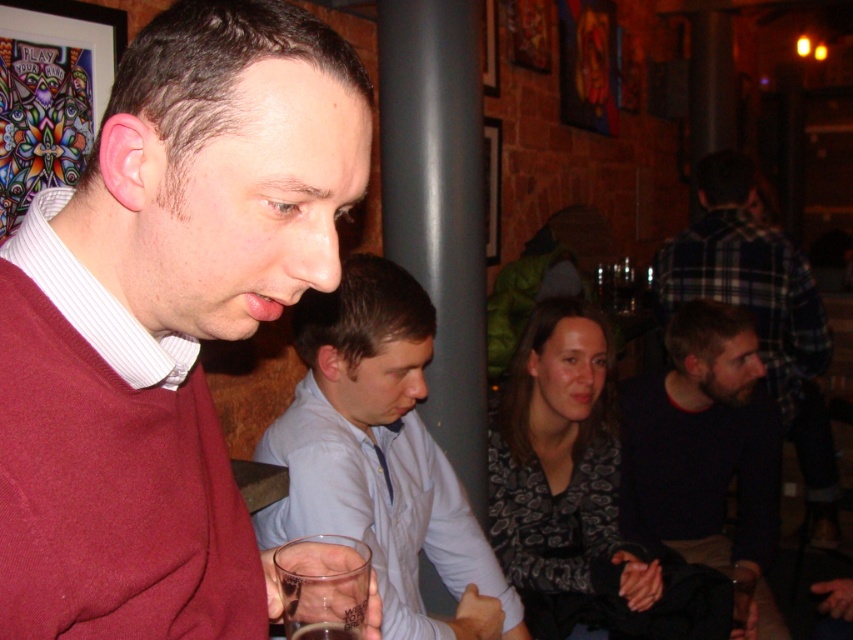
From the picture: You are a fashion designer observing the scene at the bar. You need to determine the layering order of the maroon sweater at center and the white shirt at center. Which one is visible on top?

The maroon sweater at center is positioned over white shirt at center, so the maroon sweater at center is visible on top.

You are standing at the entrance of the bar and want to find the man in the maroon sweater at center. According to the coordinates provided, which direction should you look to locate him?

The maroon sweater at center is located at coordinates point (165,321), which means it is in the center of the image. So you should look straight ahead to locate him.